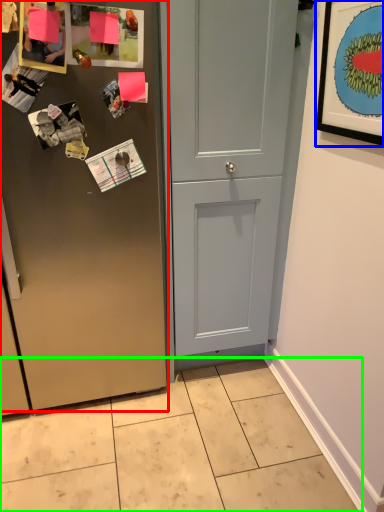
Question: Which is farther away from door (highlighted by a red box)? picture frame (highlighted by a blue box) or tile (highlighted by a green box)?

Choices:
 (A) picture frame
 (B) tile

Answer: (A)